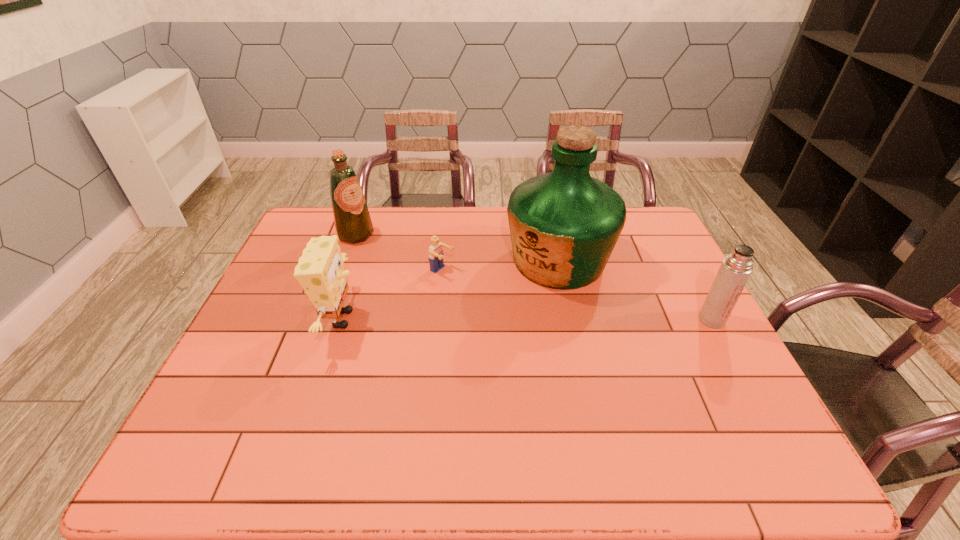
Find the location of `sponge`. sponge is located at coordinates (320, 271).

Find the location of a particular element. The image size is (960, 540). thermos bottle is located at coordinates (735, 270).

In order to click on Lego in this screenshot , I will do `click(435, 251)`.

Locate an element on the screen. The width and height of the screenshot is (960, 540). the shortest object is located at coordinates click(x=435, y=251).

The height and width of the screenshot is (540, 960). Identify the location of the fourth object from left to right. (564, 225).

This screenshot has width=960, height=540. I want to click on the tallest object, so click(564, 225).

I want to click on the second tallest object, so click(x=353, y=224).

Find the location of a particular element. The image size is (960, 540). vacant space situated 0.140m on the face of the sponge is located at coordinates (413, 319).

You are a GUI agent. You are given a task and a screenshot of the screen. Output one action in this format:
    pyautogui.click(x=<x>, y=<y>)
    Task: Click on the free space located 0.270m on the back of the rightmost object
    The width and height of the screenshot is (960, 540).
    Given the screenshot: What is the action you would take?
    pyautogui.click(x=675, y=251)

This screenshot has width=960, height=540. In order to click on free region located 0.380m on the face of the Lego in this screenshot , I will do click(563, 335).